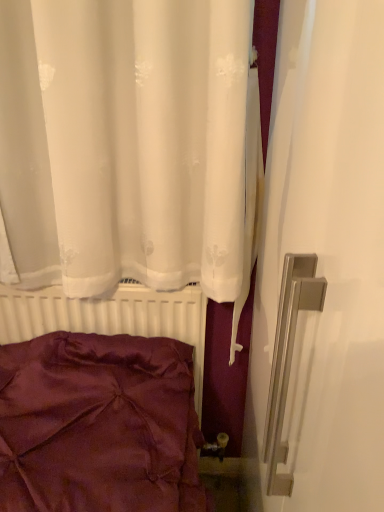
Question: From the image's perspective, is satin burgundy pillow at lower left positioned above or below white matte radiator at lower left?

Choices:
 (A) above
 (B) below

Answer: (A)

Question: Is point (125, 431) closer or farther from the camera than point (84, 305)?

Choices:
 (A) closer
 (B) farther

Answer: (A)

Question: Based on their positions, is satin burgundy pillow at lower left located to the left or right of white matte radiator at lower left?

Choices:
 (A) left
 (B) right

Answer: (A)

Question: Considering the positions of white matte radiator at lower left and satin burgundy pillow at lower left in the image, is white matte radiator at lower left wider or thinner than satin burgundy pillow at lower left?

Choices:
 (A) thin
 (B) wide

Answer: (A)

Question: From a real-world perspective, is white matte radiator at lower left above or below satin burgundy pillow at lower left?

Choices:
 (A) above
 (B) below

Answer: (B)

Question: Is white matte radiator at lower left in front of or behind satin burgundy pillow at lower left in the image?

Choices:
 (A) front
 (B) behind

Answer: (B)

Question: Is point (64, 330) positioned closer to the camera than point (33, 495)?

Choices:
 (A) closer
 (B) farther

Answer: (B)